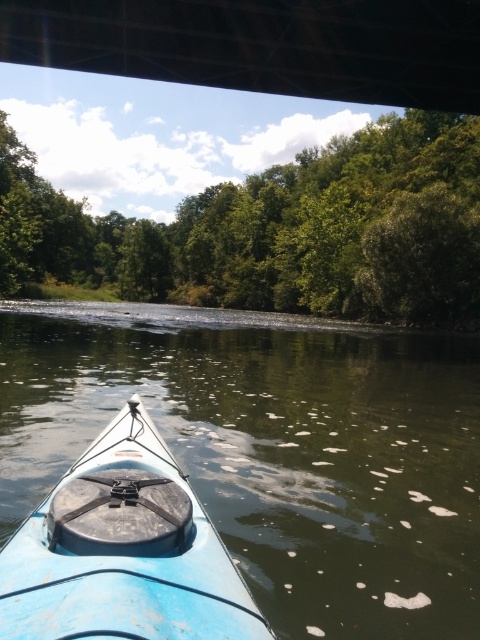
Question: Is green leafy trees at center positioned behind dark metal bridge at upper center?

Choices:
 (A) no
 (B) yes

Answer: (B)

Question: Is dark metal bridge at upper center to the left of light blue plastic kayak at center from the viewer's perspective?

Choices:
 (A) no
 (B) yes

Answer: (A)

Question: Which object is closer to the camera taking this photo?

Choices:
 (A) light blue plastic kayak at center
 (B) dark metal bridge at upper center

Answer: (A)

Question: Which of the following is the closest to the observer?

Choices:
 (A) blue plastic kayak at lower left
 (B) green leafy trees at center
 (C) light blue plastic kayak at center
 (D) dark metal bridge at upper center

Answer: (C)

Question: Among these objects, which one is nearest to the camera?

Choices:
 (A) blue plastic kayak at lower left
 (B) dark metal bridge at upper center

Answer: (A)

Question: Does blue plastic kayak at lower left come in front of dark metal bridge at upper center?

Choices:
 (A) no
 (B) yes

Answer: (B)